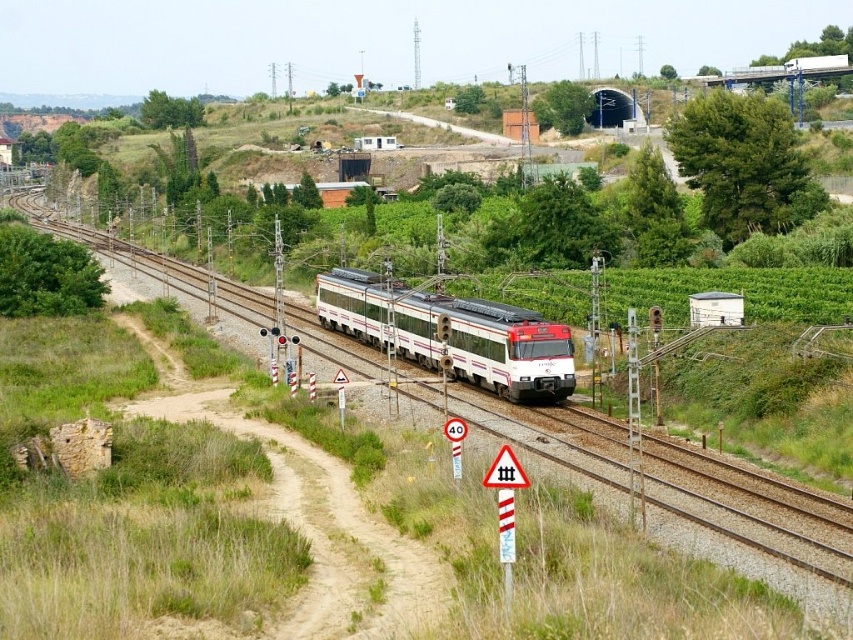
Question: Which point is farther to the camera?

Choices:
 (A) white glossy train at center
 (B) white glossy passenger train at center

Answer: (B)

Question: Where is white glossy train at center located in relation to white glossy passenger train at center in the image?

Choices:
 (A) below
 (B) above

Answer: (B)

Question: Which point is closer to the camera taking this photo?

Choices:
 (A) (383, 320)
 (B) (838, 563)

Answer: (B)

Question: Is white glossy train at center closer to the viewer compared to white glossy passenger train at center?

Choices:
 (A) no
 (B) yes

Answer: (B)

Question: Does white glossy train at center come behind white glossy passenger train at center?

Choices:
 (A) yes
 (B) no

Answer: (B)

Question: Which object appears closest to the camera in this image?

Choices:
 (A) white glossy train at center
 (B) white glossy passenger train at center

Answer: (A)